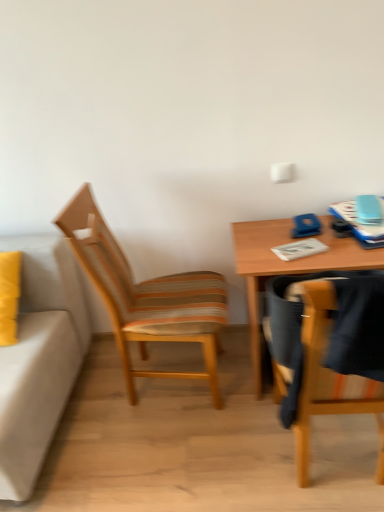
Question: From their relative heights in the image, would you say white paper notepad at center is taller or shorter than woodenchair at left, the first chair when ordered from back to front?

Choices:
 (A) short
 (B) tall

Answer: (A)

Question: From the image's perspective, relative to woodenchair at left, positioned as the second chair in right-to-left order, is white paper notepad at center above or below?

Choices:
 (A) below
 (B) above

Answer: (B)

Question: Considering the real-world distances, which object is farthest from the wooden chair at right, arranged as the 2th chair when viewed from the back?

Choices:
 (A) woodenchair at left, which is the second chair in front-to-back order
 (B) white paper notepad at center
 (C) wooden table at right

Answer: (A)

Question: Estimate the real-world distances between objects in this image. Which object is closer to the wooden table at right?

Choices:
 (A) wooden chair at right, which is the 2th chair in left-to-right order
 (B) white paper notepad at center
 (C) woodenchair at left, which is the second chair in front-to-back order

Answer: (B)